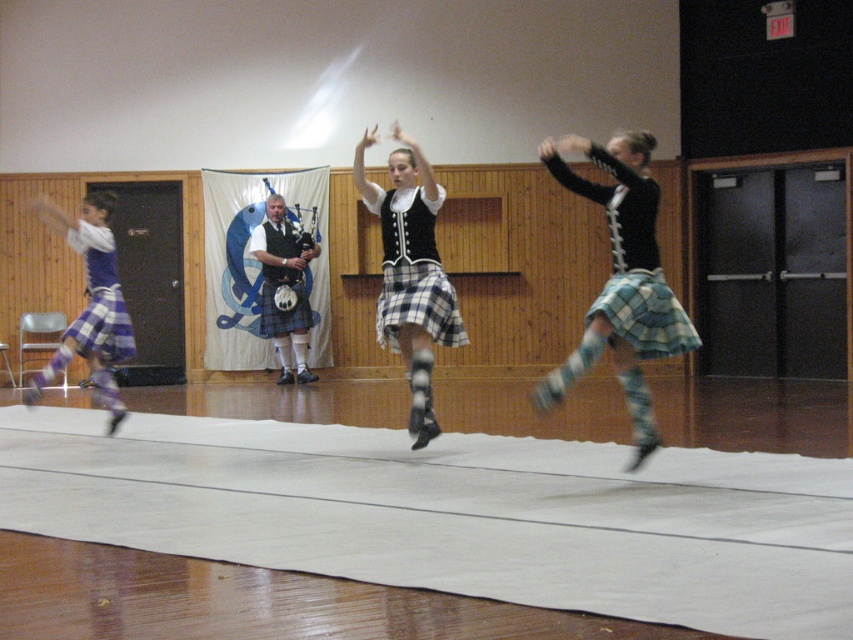
Does plaid skirt at center have a lesser width compared to plaid skirt at left?

In fact, plaid skirt at center might be wider than plaid skirt at left.

Does plaid skirt at center have a lesser height compared to plaid skirt at left?

No, plaid skirt at center is not shorter than plaid skirt at left.

Where is `plaid skirt at center`? This screenshot has width=853, height=640. plaid skirt at center is located at coordinates (622, 282).

Does black plaid skirt at center come in front of plaid skirt at left?

Yes, black plaid skirt at center is in front of plaid skirt at left.

Can you confirm if black plaid skirt at center is shorter than plaid skirt at left?

In fact, black plaid skirt at center may be taller than plaid skirt at left.

Between point (410, 348) and point (73, 248), which one is positioned in front?

Point (410, 348)

You are a GUI agent. You are given a task and a screenshot of the screen. Output one action in this format:
    pyautogui.click(x=<x>, y=<y>)
    Task: Click on the black plaid skirt at center
    The height and width of the screenshot is (640, 853).
    Given the screenshot: What is the action you would take?
    pyautogui.click(x=410, y=273)

Which is more to the right, black plaid skirt at center or plaid woolen kilt at right?

plaid woolen kilt at right

Is black plaid skirt at center to the right of plaid woolen kilt at right from the viewer's perspective?

Incorrect, black plaid skirt at center is not on the right side of plaid woolen kilt at right.

Between point (415, 392) and point (640, 340), which one is positioned behind?

Point (415, 392)

At what (x,y) coordinates should I click in order to perform the action: click on black plaid skirt at center. Please return your answer as a coordinate pair (x, y). Looking at the image, I should click on [x=410, y=273].